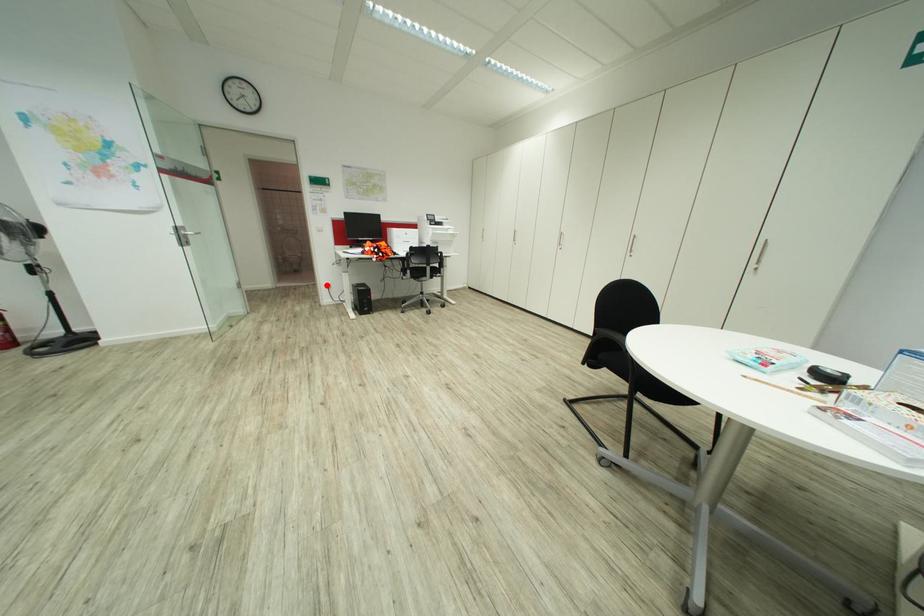
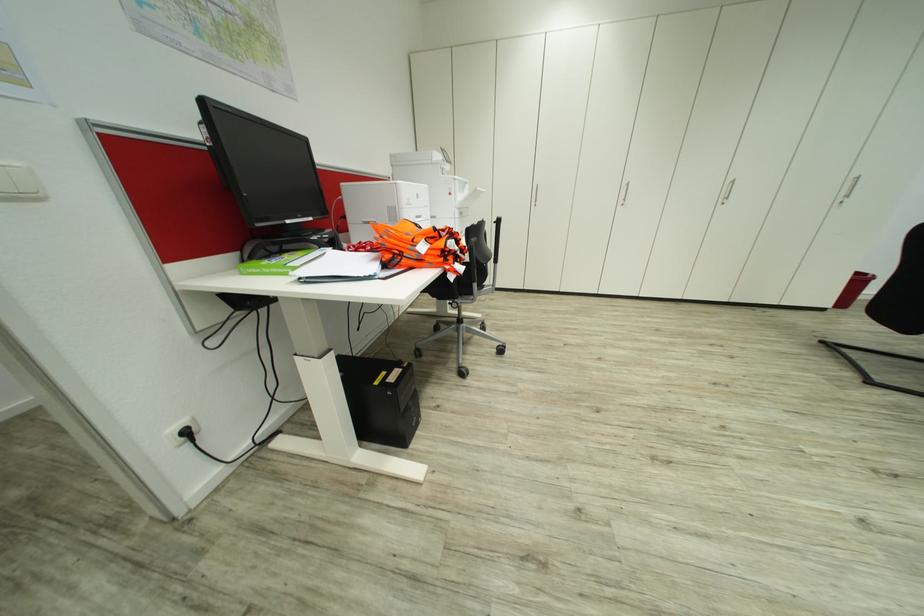
Where in the second image is the point corresponding to the highlighted location from the first image?

(186, 432)